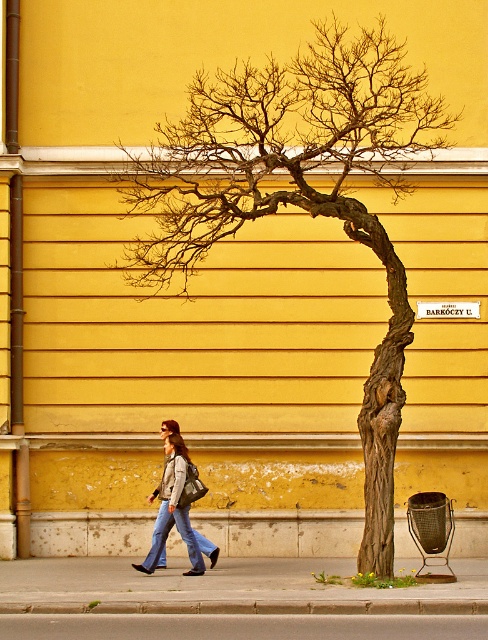
You are standing at the bottom of the image and want to walk towards the gray concrete pavement at lower center. Which direction should you move to reach it?

Since the gray concrete pavement at lower center is located at point (242,627), which is slightly to the right of the center on the lower part of the image, you should move towards the right to reach it.

You are an artist planning to paint this scene. You want to ensure the brown textured tree trunk at center and the denim jeans at lower left are proportionally accurate. Which object should you make larger in your painting?

The brown textured tree trunk at center should be made larger than the denim jeans at lower left because it is larger in size according to the description.

You are a city planner assessing the space between the brown textured tree trunk at center and the gray concrete sidewalk at lower center. Based on their widths, which one is narrower?

The brown textured tree trunk at center is narrower than the gray concrete sidewalk at lower center.